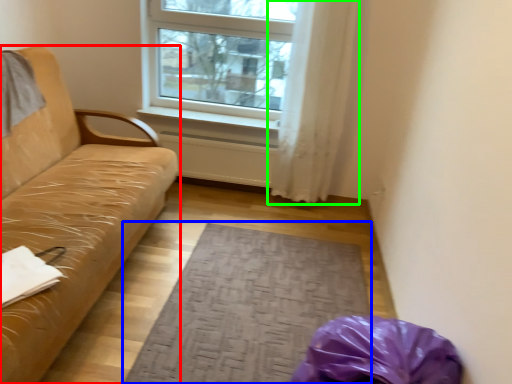
Question: Based on their relative distances, which object is nearer to studio couch (highlighted by a red box)? Choose from mat (highlighted by a blue box) and curtain (highlighted by a green box).

Choices:
 (A) mat
 (B) curtain

Answer: (A)